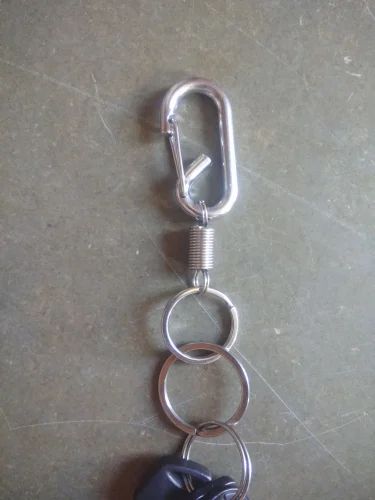
Identify the location of scratches on table top. The height and width of the screenshot is (500, 375). (110, 105), (122, 422), (154, 413), (288, 407), (277, 51), (103, 125).